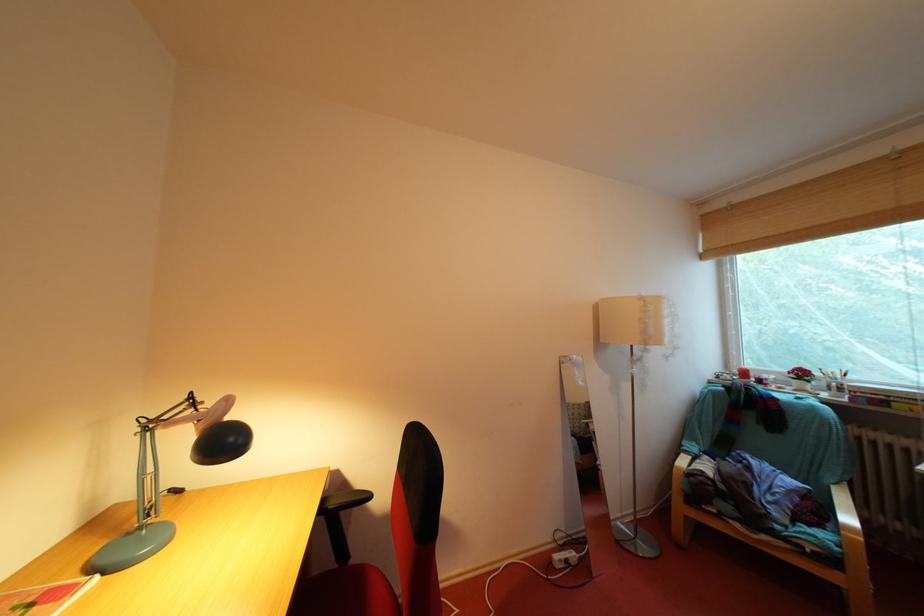
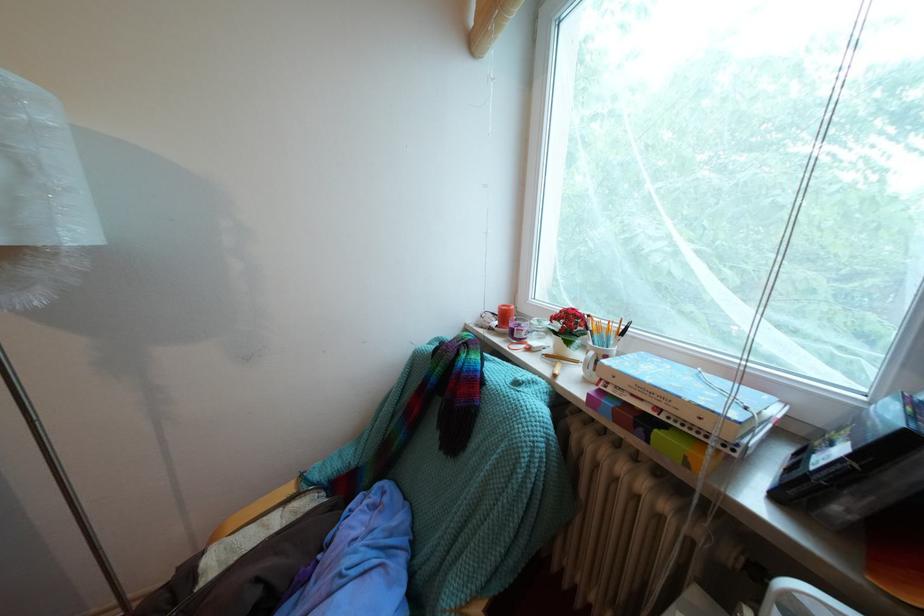
In a continuous first-person perspective shot, in which direction is the camera moving?

The cameraman walked toward right, forward.